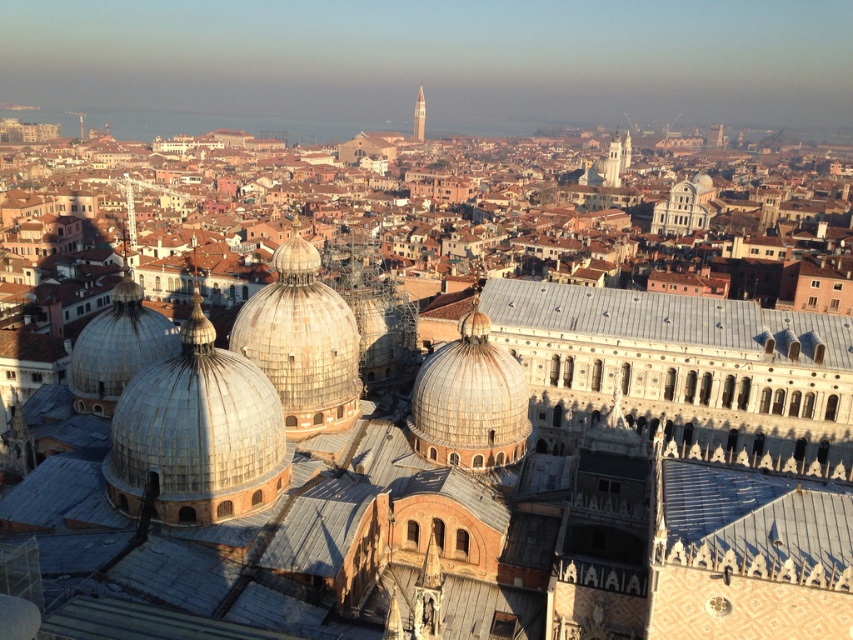
Question: Which is farther from the silver metallic domes at center?

Choices:
 (A) gray metallic roof at center
 (B) silver metallic bell tower at center
 (C) silver metallic dome at center
 (D) white marble tower at upper right

Answer: (B)

Question: Is silver metallic dome at center further to camera compared to matte silver dome at center?

Choices:
 (A) yes
 (B) no

Answer: (A)

Question: Which point appears farthest from the camera in this image?

Choices:
 (A) (595, 301)
 (B) (422, 116)
 (C) (418, 449)

Answer: (B)

Question: Is silver metallic dome at center to the right of matte silver dome at center from the viewer's perspective?

Choices:
 (A) no
 (B) yes

Answer: (A)

Question: Which object is farther from the camera taking this photo?

Choices:
 (A) silver metallic domes at center
 (B) silver metallic bell tower at center
 (C) matte silver dome at center

Answer: (B)

Question: Is silver metallic dome at center positioned in front of matte silver dome at center?

Choices:
 (A) no
 (B) yes

Answer: (A)